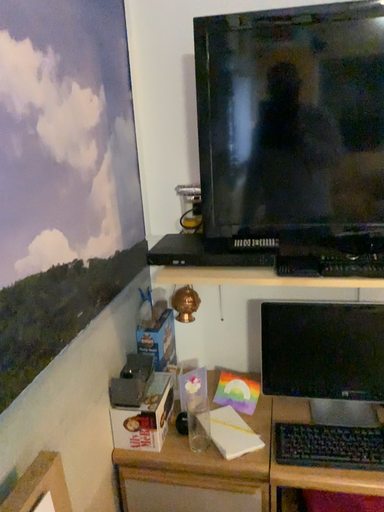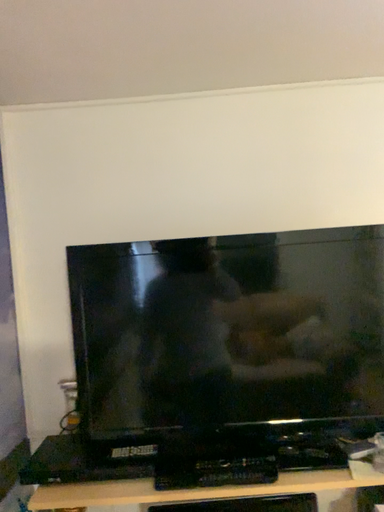
Question: Which way did the camera rotate in the video?

Choices:
 (A) rotated upward
 (B) rotated downward

Answer: (A)